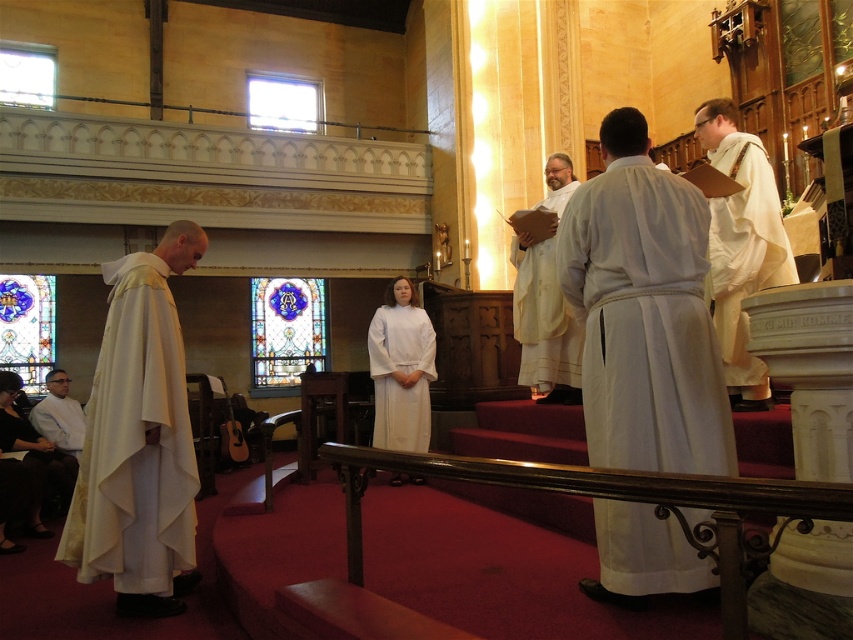
What is the spatial relationship between the white matte robe at center and the stained glass window at center in the church scene?

The white matte robe at center is closer to the viewer than the stained glass window at center.

You are attending a religious ceremony in the church and need to locate the clergy member wearing the white matte robe at center. According to the spatial coordinates provided, where exactly is this robe positioned within the image?

The white matte robe at center is located at point coordinates 0.500 on the x and 0.638 on the y axis, meaning it is centrally positioned horizontally and slightly lower vertically in the image.